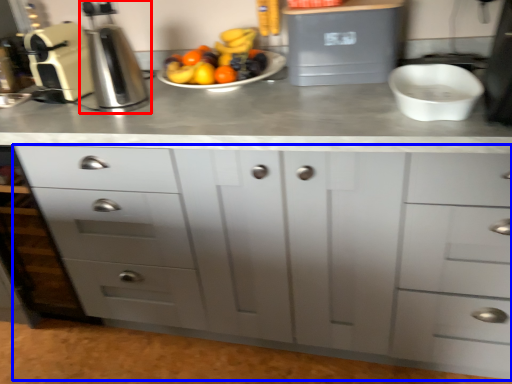
Question: Which object is further to the camera taking this photo, coffee machine (highlighted by a red box) or chest of drawers (highlighted by a blue box)?

Choices:
 (A) coffee machine
 (B) chest of drawers

Answer: (A)